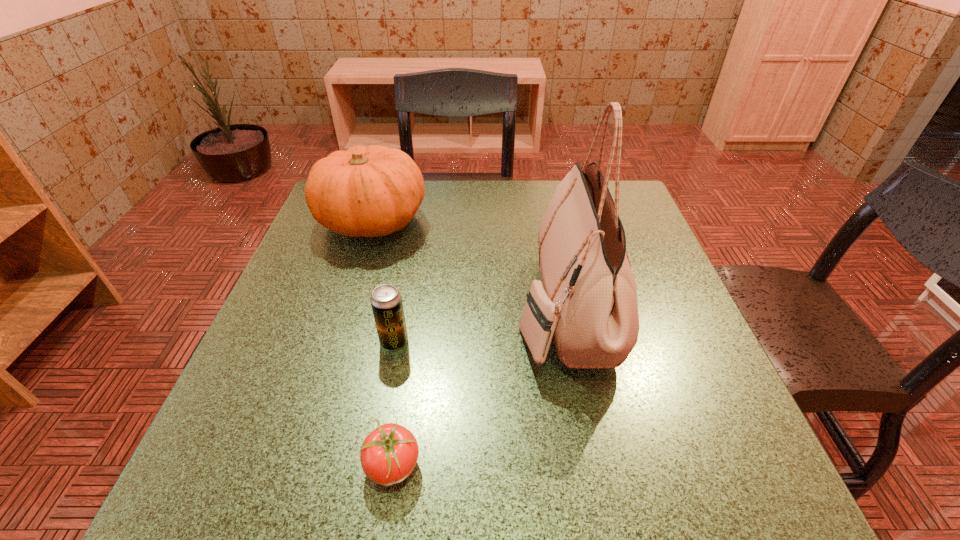
At what (x,y) coordinates should I click in order to perform the action: click on free space at the right edge of the desktop. Please return your answer as a coordinate pair (x, y). Looking at the image, I should click on (665, 262).

This screenshot has width=960, height=540. In order to click on vacant space at the near left corner of the desktop in this screenshot , I will do `click(266, 485)`.

Identify the location of vacant space at the far right corner of the desktop. Image resolution: width=960 pixels, height=540 pixels. (647, 226).

Locate an element on the screen. Image resolution: width=960 pixels, height=540 pixels. vacant area at the near right corner of the desktop is located at coordinates pos(768,470).

You are a GUI agent. You are given a task and a screenshot of the screen. Output one action in this format:
    pyautogui.click(x=<x>, y=<y>)
    Task: Click on the empty location between the handbag and the tomato
    This screenshot has width=960, height=540.
    Given the screenshot: What is the action you would take?
    pyautogui.click(x=479, y=386)

This screenshot has width=960, height=540. In order to click on empty location between the pumpkin and the beer can in this screenshot , I will do `click(383, 281)`.

The image size is (960, 540). In order to click on free space that is in between the second shortest object and the rightmost object in this screenshot , I will do `click(479, 325)`.

You are a GUI agent. You are given a task and a screenshot of the screen. Output one action in this format:
    pyautogui.click(x=<x>, y=<y>)
    Task: Click on the free point between the second tallest object and the beer can
    This screenshot has height=540, width=960.
    Given the screenshot: What is the action you would take?
    pyautogui.click(x=383, y=281)

Image resolution: width=960 pixels, height=540 pixels. Identify the location of free space between the rightmost object and the pumpkin. (468, 264).

The height and width of the screenshot is (540, 960). Find the location of `free spot between the rightmost object and the third tallest object`. free spot between the rightmost object and the third tallest object is located at coordinates (479, 325).